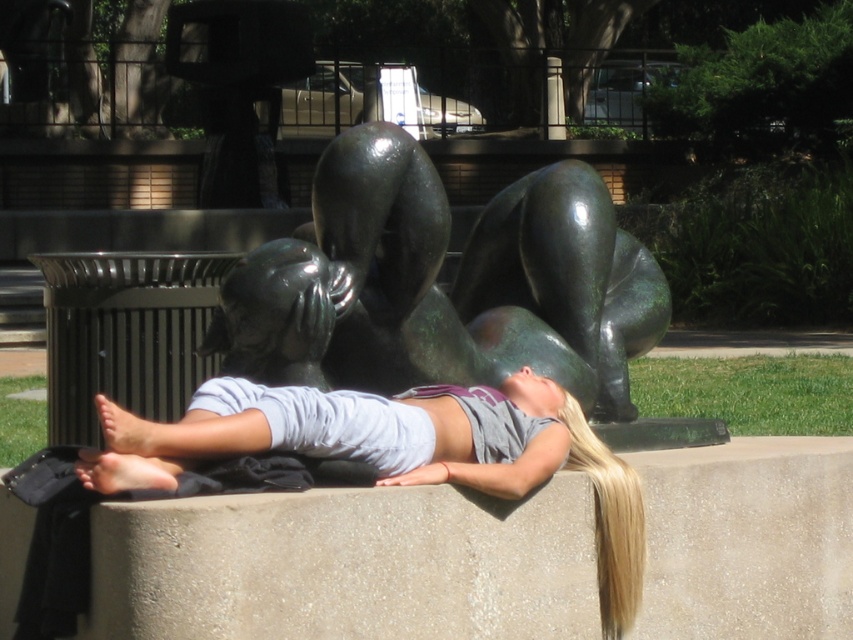
You are a photographer standing at the edge of the park. You want to take a photo of the gray cotton shirt at center and the green patina sculpture at center. Which object should you focus on first to ensure both are in focus?

You should focus on the green patina sculpture at center first since it is closer to you than the gray cotton shirt at center, ensuring both will be in focus when focused on the closer object.

You are standing at point (438, 285) in the image. What object is located exactly at this point?

The green patina sculpture at center is located exactly at point (438, 285).